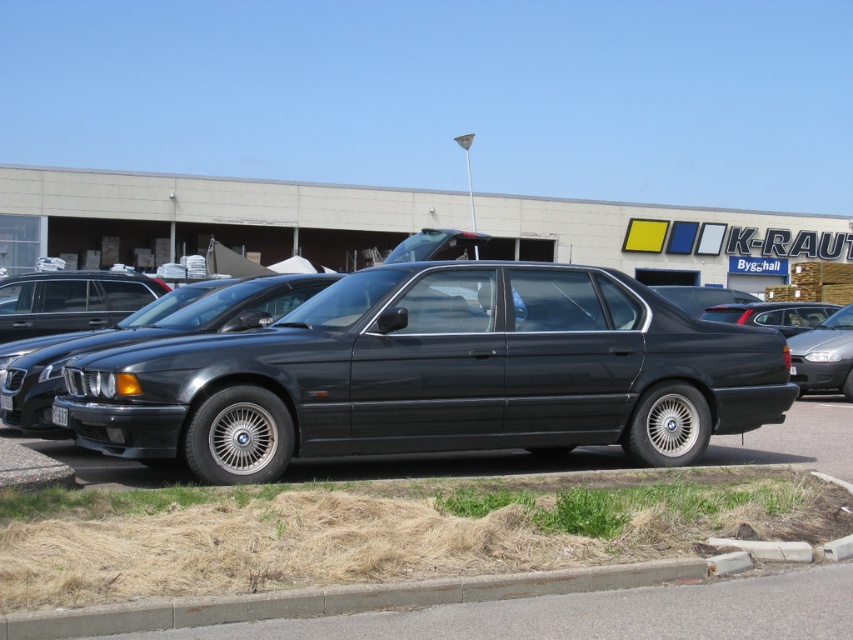
You are standing at the entrance of the building and want to take a photo of the satin black sedan at center. Based on its position, where should you aim your camera to capture it in the frame?

You should aim your camera towards the lower central area of the image to capture the satin black sedan at center, as it is located at point coordinates approximately 0.555 on the x axis and 0.967 on the y axis.

Based on the scene description, where is the matte black car at right located in the image?

The matte black car at right is located at point (772, 314).